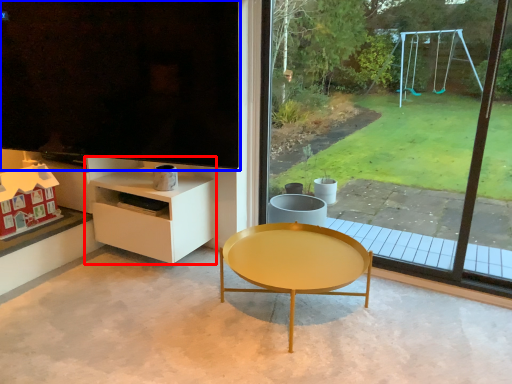
Question: Which of the following is the farthest to the observer, shelf (highlighted by a red box) or window screen (highlighted by a blue box)?

Choices:
 (A) shelf
 (B) window screen

Answer: (A)